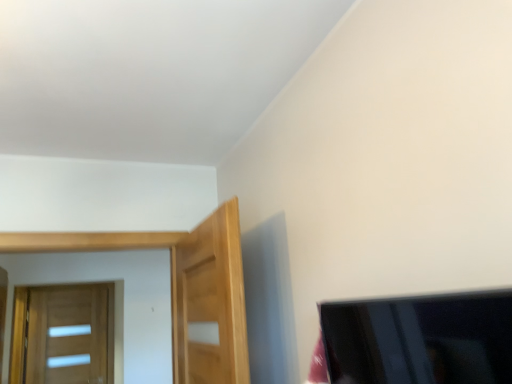
Where is `wooden door at left`? The height and width of the screenshot is (384, 512). wooden door at left is located at coordinates (70, 335).

The width and height of the screenshot is (512, 384). Describe the element at coordinates (70, 335) in the screenshot. I see `wooden door at left` at that location.

Where is `wooden door at left`? wooden door at left is located at coordinates (70, 335).